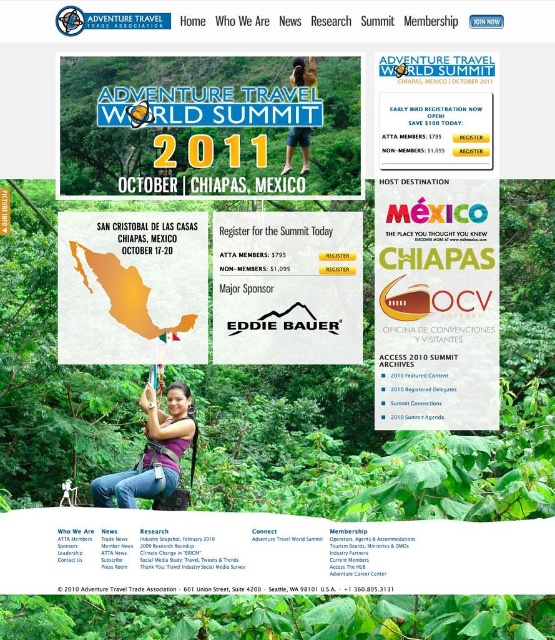
Based on the photo, does matte purple shirt at center have a greater width compared to matte black shorts at upper center?

Yes.

I want to click on matte purple shirt at center, so click(x=153, y=451).

Is metallic green sign at center smaller than matte map of mexico at center?

No.

Who is more forward, (379, 371) or (120, 218)?

Positioned in front is point (120, 218).

Locate an element on the screen. This screenshot has width=555, height=640. metallic green sign at center is located at coordinates (436, 305).

Can you confirm if metallic green sign at center is smaller than matte purple shirt at center?

No.

Who is higher up, metallic green sign at center or matte purple shirt at center?

metallic green sign at center is above.

This screenshot has width=555, height=640. What are the coordinates of `metallic green sign at center` in the screenshot? It's located at pyautogui.click(x=436, y=305).

Identify the location of metallic green sign at center. pyautogui.click(x=436, y=305).